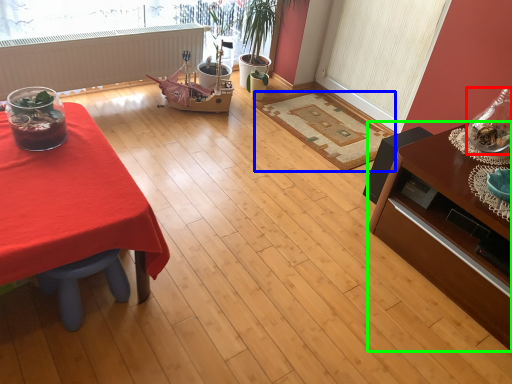
Question: Considering the real-world distances, which object is closest to glass vase (highlighted by a red box)? mat (highlighted by a blue box) or table (highlighted by a green box).

Choices:
 (A) mat
 (B) table

Answer: (B)